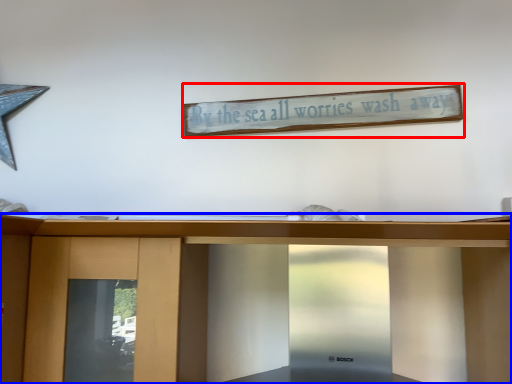
Question: Which of the following is the farthest to the observer, bulletin board (highlighted by a red box) or furniture (highlighted by a blue box)?

Choices:
 (A) bulletin board
 (B) furniture

Answer: (A)